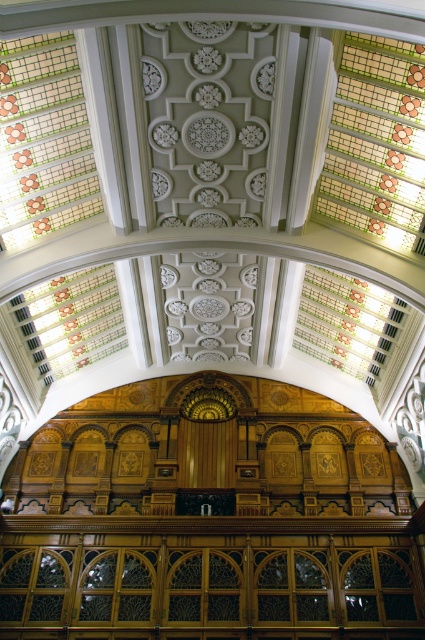
Question: Does clear glass window at center have a smaller size compared to stained glass window at upper center?

Choices:
 (A) no
 (B) yes

Answer: (B)

Question: Which point is farther to the camera?

Choices:
 (A) stained glass window at upper center
 (B) clear glass window at center
 (C) stained glass window at upper left

Answer: (B)

Question: Is stained glass window at upper center above stained glass window at upper left?

Choices:
 (A) yes
 (B) no

Answer: (B)

Question: Which object appears closest to the camera in this image?

Choices:
 (A) stained glass window at upper left
 (B) stained glass window at upper center

Answer: (A)

Question: Where is clear glass window at center located in relation to stained glass window at upper center in the image?

Choices:
 (A) above
 (B) below

Answer: (B)

Question: Which object is positioned closest to the stained glass window at upper center?

Choices:
 (A) stained glass window at upper left
 (B) clear glass window at center

Answer: (A)